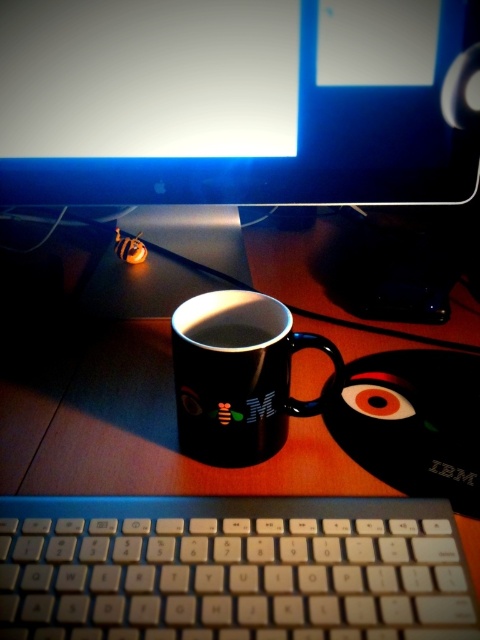
Question: Which point appears closest to the camera in this image?

Choices:
 (A) (72, 266)
 (B) (206, 460)
 (C) (202, 342)

Answer: (C)

Question: Is black glossy monitor at upper center above black glossy mug at center?

Choices:
 (A) yes
 (B) no

Answer: (A)

Question: Considering the real-world distances, which object is closest to the black matte coffee cup at center?

Choices:
 (A) black glossy mouse pad at center
 (B) white plastic keyboard at lower center
 (C) black glossy mug at center
 (D) black glossy monitor at upper center

Answer: (C)

Question: Which object is the farthest from the black glossy mouse pad at center?

Choices:
 (A) black matte coffee cup at center
 (B) black glossy mug at center

Answer: (A)

Question: In this image, where is black glossy mouse pad at center located relative to black glossy monitor at upper center?

Choices:
 (A) left
 (B) right

Answer: (B)

Question: Is black glossy mouse pad at center below black glossy monitor at upper center?

Choices:
 (A) no
 (B) yes

Answer: (B)